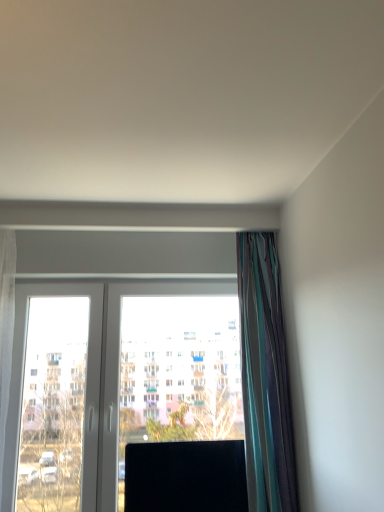
Question: From a real-world perspective, is multicolored silky curtain at right located beneath black glossy screen at center?

Choices:
 (A) no
 (B) yes

Answer: (A)

Question: Is multicolored silky curtain at right smaller than black glossy screen at center?

Choices:
 (A) no
 (B) yes

Answer: (A)

Question: Is the depth of multicolored silky curtain at right greater than that of black glossy screen at center?

Choices:
 (A) no
 (B) yes

Answer: (A)

Question: Is multicolored silky curtain at right looking in the opposite direction of black glossy screen at center?

Choices:
 (A) no
 (B) yes

Answer: (A)

Question: Considering the relative sizes of multicolored silky curtain at right and black glossy screen at center in the image provided, is multicolored silky curtain at right shorter than black glossy screen at center?

Choices:
 (A) yes
 (B) no

Answer: (B)

Question: Visually, is transparent glass window at center positioned to the left or to the right of multicolored silky curtain at right?

Choices:
 (A) right
 (B) left

Answer: (B)

Question: From a real-world perspective, is transparent glass window at center positioned above or below multicolored silky curtain at right?

Choices:
 (A) above
 (B) below

Answer: (B)

Question: Based on their sizes in the image, would you say transparent glass window at center is bigger or smaller than multicolored silky curtain at right?

Choices:
 (A) small
 (B) big

Answer: (B)

Question: From the image's perspective, relative to multicolored silky curtain at right, is transparent glass window at center above or below?

Choices:
 (A) above
 (B) below

Answer: (B)

Question: From the image's perspective, is black glossy screen at center positioned above or below multicolored silky curtain at right?

Choices:
 (A) below
 (B) above

Answer: (A)

Question: Considering the positions of black glossy screen at center and multicolored silky curtain at right in the image, is black glossy screen at center bigger or smaller than multicolored silky curtain at right?

Choices:
 (A) small
 (B) big

Answer: (A)

Question: Visually, is black glossy screen at center positioned to the left or to the right of multicolored silky curtain at right?

Choices:
 (A) left
 (B) right

Answer: (A)

Question: From a real-world perspective, is black glossy screen at center positioned above or below multicolored silky curtain at right?

Choices:
 (A) above
 (B) below

Answer: (B)

Question: From the image's perspective, relative to black glossy screen at center, is multicolored silky curtain at right above or below?

Choices:
 (A) below
 (B) above

Answer: (B)

Question: Is multicolored silky curtain at right wider or thinner than black glossy screen at center?

Choices:
 (A) thin
 (B) wide

Answer: (B)